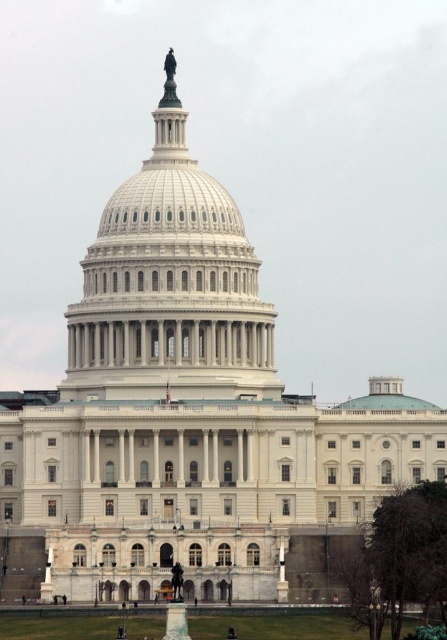
Question: Can you confirm if white marble dome at center is wider than clear glass dome at center?

Choices:
 (A) no
 (B) yes

Answer: (B)

Question: Which point is closer to the camera?

Choices:
 (A) clear glass dome at center
 (B) white marble dome at center

Answer: (B)

Question: Which point is closer to the camera?

Choices:
 (A) (350, 404)
 (B) (83, 264)

Answer: (A)

Question: Observing the image, what is the correct spatial positioning of white marble dome at center in reference to clear glass dome at center?

Choices:
 (A) left
 (B) right

Answer: (A)

Question: Which point is farther to the camera?

Choices:
 (A) clear glass dome at center
 (B) white marble dome at center

Answer: (A)

Question: Is white marble dome at center to the right of clear glass dome at center from the viewer's perspective?

Choices:
 (A) no
 (B) yes

Answer: (A)